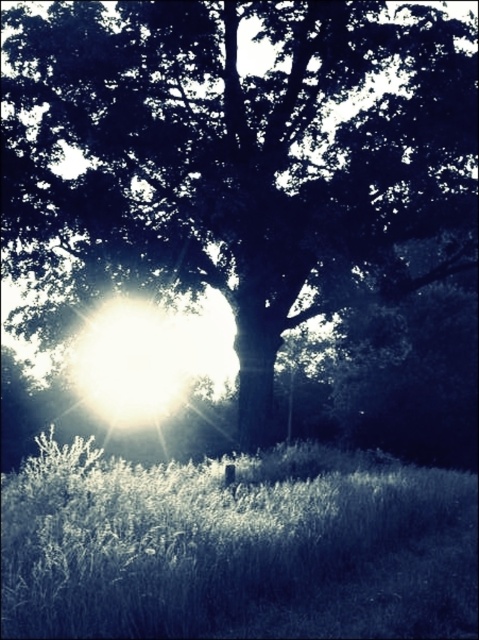
Between dark green leafy tree at center and white soft grass at lower center, which one is positioned lower?

Positioned lower is white soft grass at lower center.

This screenshot has height=640, width=479. I want to click on dark green leafy tree at center, so click(x=237, y=156).